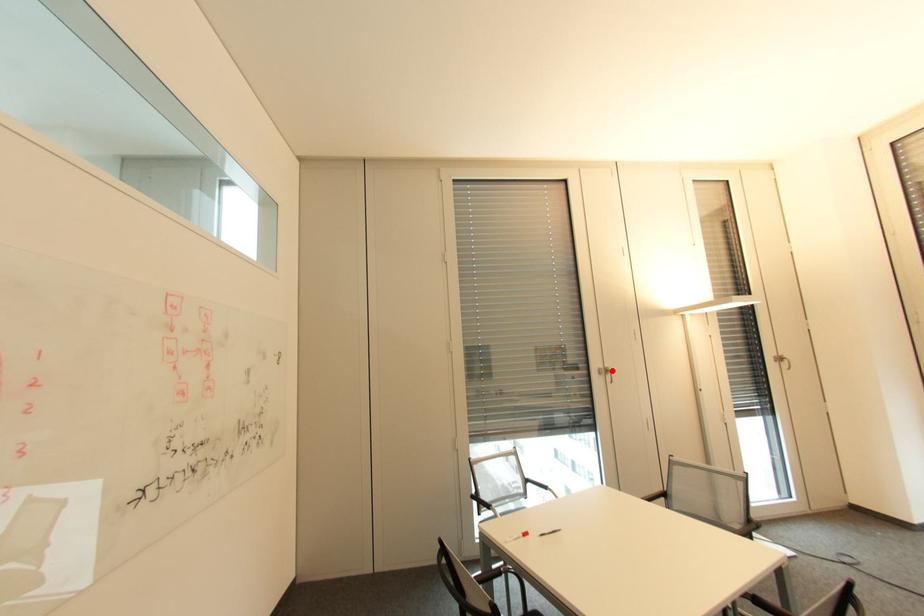
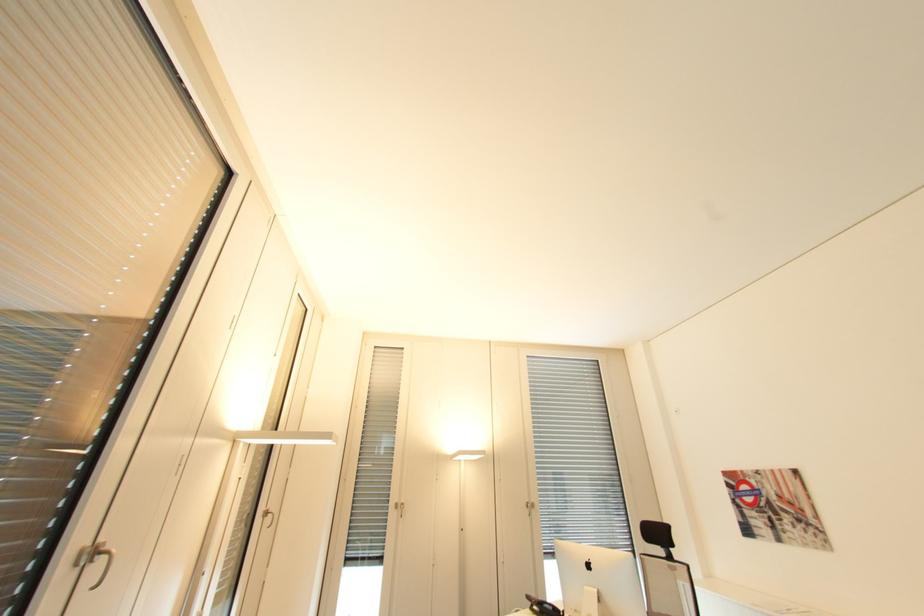
Question: I am providing you with two images of the same scene from different viewpoints. In image1, a red point is highlighted. Considering the same 3D point in image2, which of the following is correct?

Choices:
 (A) It is closer
 (B) It is farther

Answer: (A)